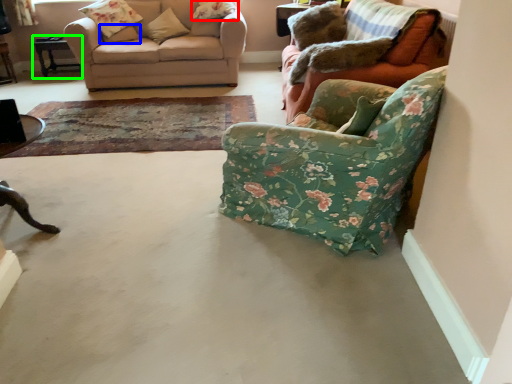
Question: Considering the real-world distances, which object is closest to pillow (highlighted by a red box)? pillow (highlighted by a blue box) or table (highlighted by a green box).

Choices:
 (A) pillow
 (B) table

Answer: (A)